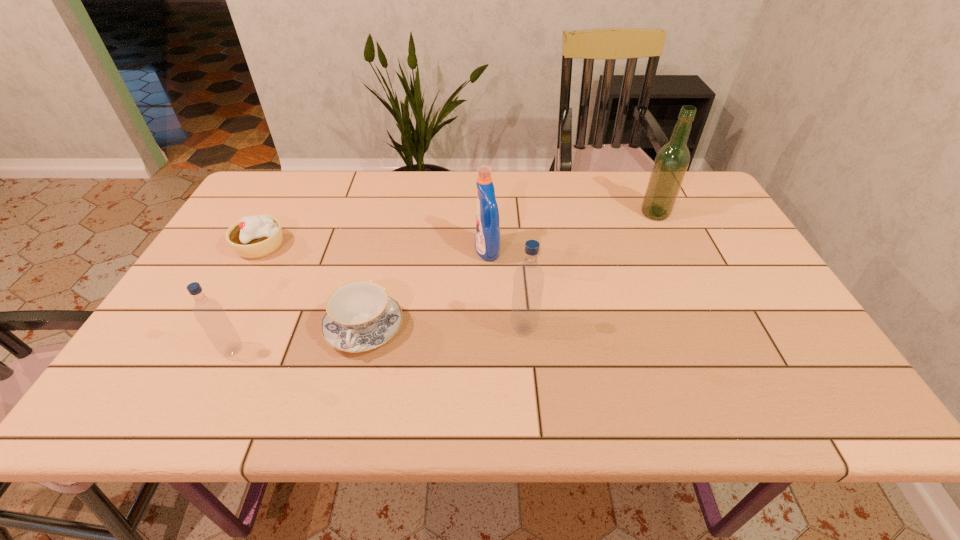
Locate an element on the screen. The image size is (960, 540). object that is at the right edge is located at coordinates (672, 160).

This screenshot has height=540, width=960. What are the coordinates of `object situated at the far right corner` in the screenshot? It's located at (672, 160).

The image size is (960, 540). Identify the location of vacant area at the far edge of the desktop. (525, 187).

The image size is (960, 540). I want to click on blank area at the near edge, so click(291, 370).

Image resolution: width=960 pixels, height=540 pixels. I want to click on vacant area at the left edge of the desktop, so click(168, 331).

Find the location of `free space at the right edge`. free space at the right edge is located at coordinates (737, 284).

This screenshot has height=540, width=960. What are the coordinates of `vacant space at the far left corner of the desktop` in the screenshot? It's located at (250, 205).

You are a GUI agent. You are given a task and a screenshot of the screen. Output one action in this format:
    pyautogui.click(x=<x>, y=<y>)
    Task: Click on the free space at the near right corner of the desktop
    
    Given the screenshot: What is the action you would take?
    pyautogui.click(x=796, y=355)

Identify the location of vacant point located between the liquor and the whipped cream. click(x=458, y=230).

Locate an element on the screen. The height and width of the screenshot is (540, 960). free spot between the whipped cream and the right water bottle is located at coordinates (392, 287).